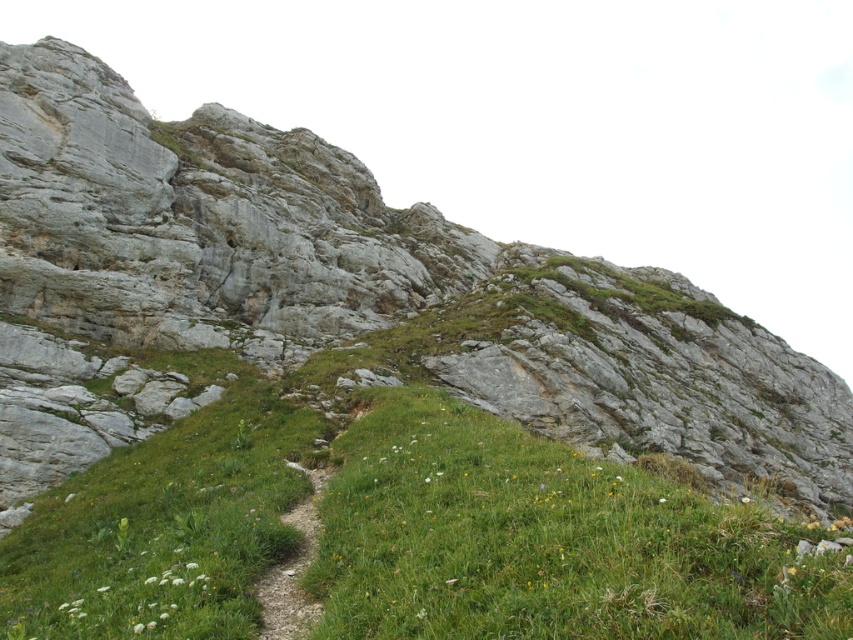
You are a hiker trying to reach the top of the hill. You see the point marked at coordinates (546, 541). Is this point located on the rocky area or the grassy area?

The point marked at coordinates (546, 541) is on the green grassy area at center, so it is located on the grassy area.

You are a hiker trying to find the best spot to set up a tent. You see the green grassy at center and the white fluffy flower at lower left. Which location would be higher in elevation?

The green grassy at center is higher in elevation than the white fluffy flower at lower left because it is positioned above it.